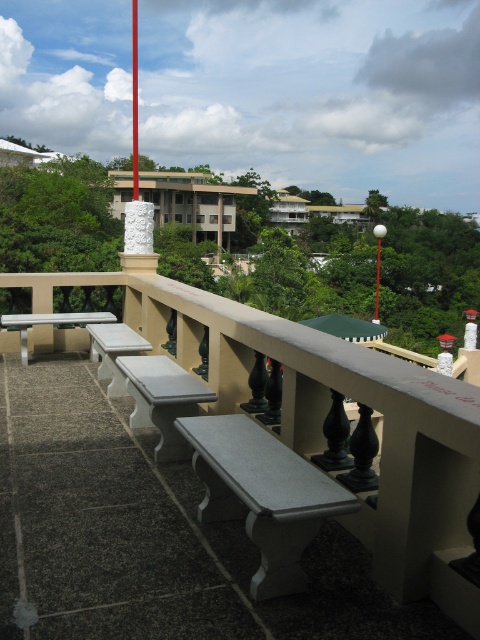
Question: Does gray stone bench at center have a greater width compared to metallic flag pole at center?

Choices:
 (A) yes
 (B) no

Answer: (B)

Question: Does smooth gray bench at center appear under smooth red flag pole at center?

Choices:
 (A) yes
 (B) no

Answer: (A)

Question: Based on their relative distances, which object is nearer to the smooth red flag pole at center?

Choices:
 (A) white glossy picnic table at left
 (B) metallic flag pole at center
 (C) gray stone bench at center

Answer: (B)

Question: Is white marble bench at lower left positioned in front of smooth red flag pole at center?

Choices:
 (A) yes
 (B) no

Answer: (A)

Question: Which object is the farthest from the white glossy picnic table at left?

Choices:
 (A) smooth red flag pole at center
 (B) white marble bench at lower left
 (C) smooth gray bench at center

Answer: (A)

Question: Estimate the real-world distances between objects in this image. Which object is closer to the gray stone bench at center?

Choices:
 (A) smooth red flag pole at center
 (B) white glossy picnic table at left
 (C) metallic flag pole at center

Answer: (B)